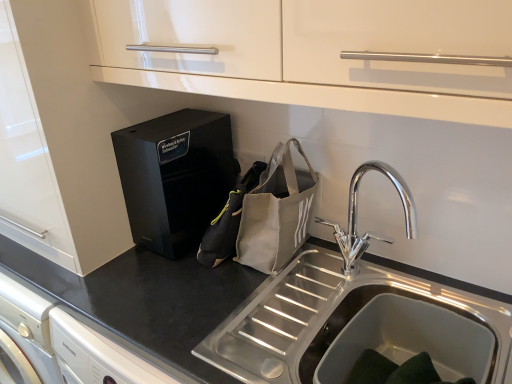
Identify the location of free space above black glossy speaker at center (from a real-world perspective). The height and width of the screenshot is (384, 512). (170, 122).